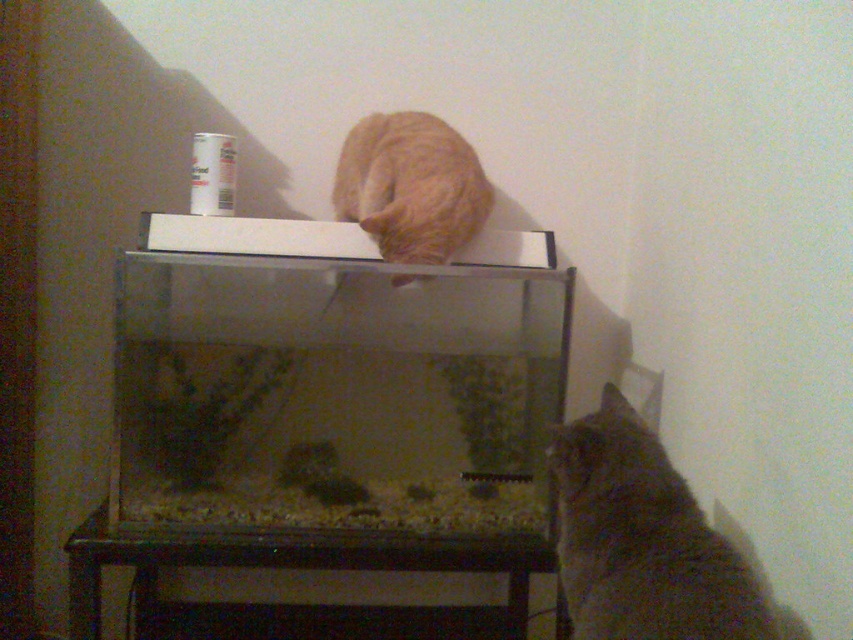
Question: Is fuzzy brown cat at lower right positioned at the back of orange fur cat at upper center?

Choices:
 (A) yes
 (B) no

Answer: (B)

Question: Does fuzzy brown cat at lower right appear under orange fur cat at upper center?

Choices:
 (A) yes
 (B) no

Answer: (A)

Question: Is fuzzy brown cat at lower right closer to camera compared to orange fur cat at upper center?

Choices:
 (A) yes
 (B) no

Answer: (A)

Question: Among these points, which one is farthest from the camera?

Choices:
 (A) tap(461, 195)
 (B) tap(670, 568)

Answer: (A)

Question: Which point is farther from the camera taking this photo?

Choices:
 (A) (660, 488)
 (B) (358, 189)

Answer: (B)

Question: Which of the following is the farthest from the observer?

Choices:
 (A) fuzzy brown cat at lower right
 (B) orange fur cat at upper center

Answer: (B)